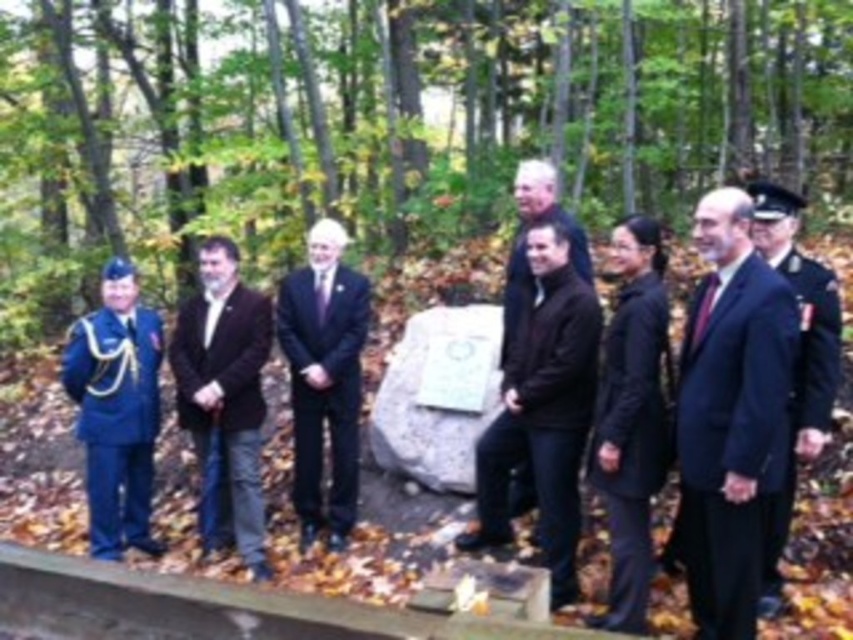
Is black suit at center wider than black matte suit at center?

Indeed, black suit at center has a greater width compared to black matte suit at center.

Can you confirm if black suit at center is shorter than black matte suit at center?

In fact, black suit at center may be taller than black matte suit at center.

Is point (350, 451) closer to camera compared to point (624, 529)?

That is False.

Identify the location of black suit at center. [323, 376].

Is dark blue suit at center above black matte suit at center?

Yes.

Between dark blue suit at center and black matte suit at center, which one appears on the right side from the viewer's perspective?

dark blue suit at center

The width and height of the screenshot is (853, 640). Identify the location of dark blue suit at center. (730, 416).

Does dark brown leather jacket at center come in front of navy blue uniform at center?

No, it is not.

Is dark brown leather jacket at center below navy blue uniform at center?

Indeed, dark brown leather jacket at center is positioned under navy blue uniform at center.

Locate an element on the screen. The height and width of the screenshot is (640, 853). dark brown leather jacket at center is located at coordinates (224, 397).